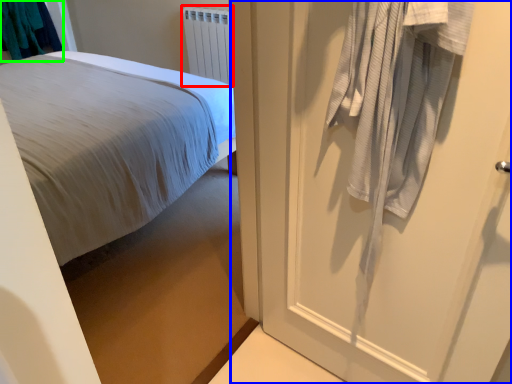
Question: Estimate the real-world distances between objects in this image. Which object is farther from radiator (highlighted by a red box), door (highlighted by a blue box) or laundry (highlighted by a green box)?

Choices:
 (A) door
 (B) laundry

Answer: (A)